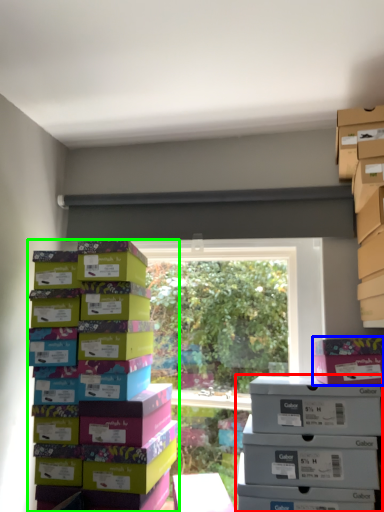
Question: Considering the real-world distances, which object is farthest from storage box (highlighted by a red box)? cardboard box (highlighted by a blue box) or box (highlighted by a green box)?

Choices:
 (A) cardboard box
 (B) box

Answer: (B)